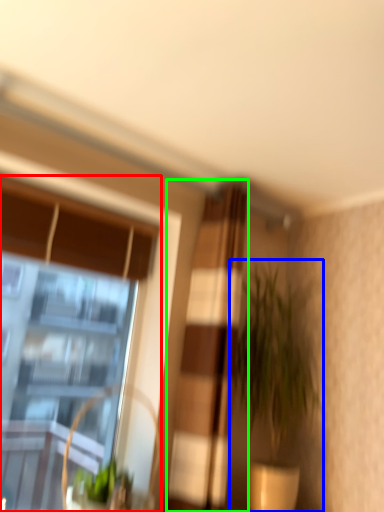
Question: Which object is the farthest from window (highlighted by a red box)? Choose among these: houseplant (highlighted by a blue box) or curtain (highlighted by a green box).

Choices:
 (A) houseplant
 (B) curtain

Answer: (B)